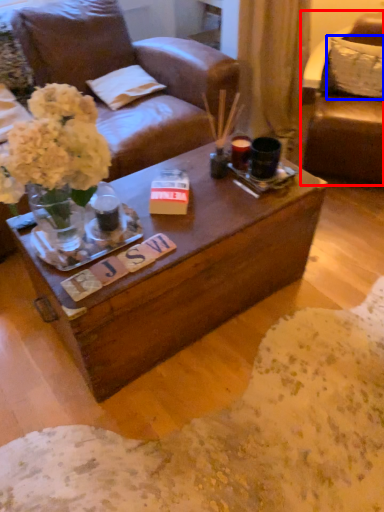
Question: Which of the following is the closest to the observer, chair (highlighted by a red box) or pillow (highlighted by a blue box)?

Choices:
 (A) chair
 (B) pillow

Answer: (A)